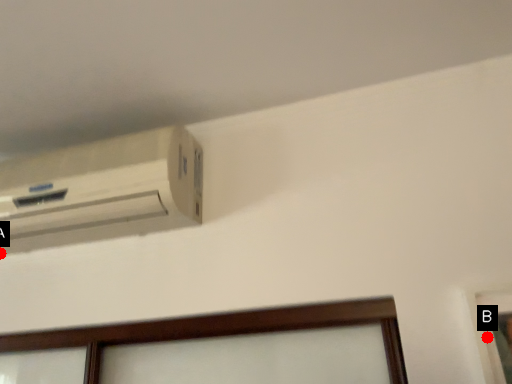
Question: Two points are circled on the image, labeled by A and B beside each circle. Which point is closer to the camera?

Choices:
 (A) A is closer
 (B) B is closer

Answer: (B)